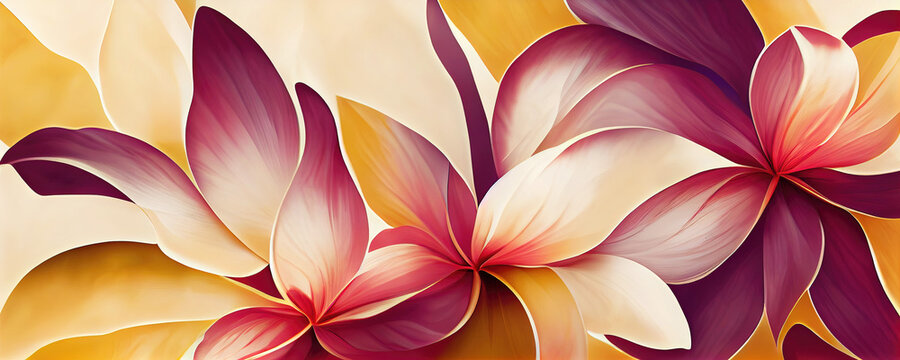
Locate an element on the screen. This screenshot has width=900, height=360. picture is located at coordinates (441, 129).